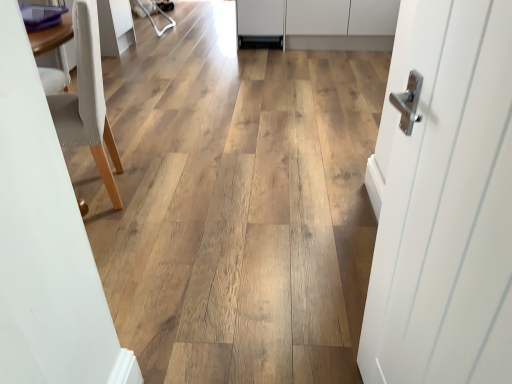
Identify the location of free space between white matte cabinet at upper center and light beige fabric chair at left. (233, 97).